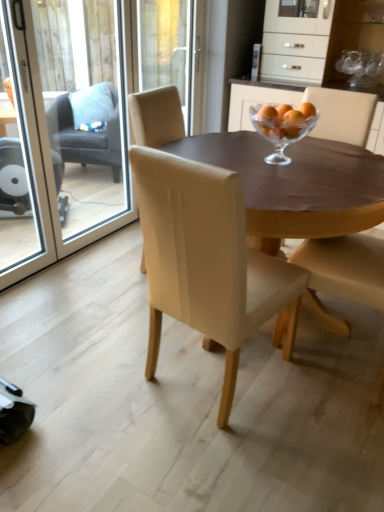
This screenshot has width=384, height=512. I want to click on beige leather chair at center, the 1th chair viewed from the front, so click(204, 258).

The image size is (384, 512). What do you see at coordinates (281, 132) in the screenshot?
I see `clear glass bowl at center` at bounding box center [281, 132].

What is the approximate width of transparent glass screen door at left, which appears as the first screen door when viewed from the right?

It is 2.82 inches.

Locate an element on the screen. light gray fabric chair at left, the 4th chair positioned from the front is located at coordinates tap(83, 139).

Describe the element at coordinates (24, 158) in the screenshot. I see `transparent glass screen door at left, the second screen door positioned from the right` at that location.

This screenshot has height=512, width=384. What do you see at coordinates (156, 117) in the screenshot?
I see `leather at center, acting as the 3th chair starting from the front` at bounding box center [156, 117].

Locate an element on the screen. beige leather chair at center, which is the fourth chair in back-to-front order is located at coordinates (204, 258).

The height and width of the screenshot is (512, 384). Identify the location of martini glass that is above the leather at center, placed as the 2th chair when sorted from left to right (from a real-world perspective). (281, 132).

Would you say leather at center, which is the 2th chair from back to front, is to the left or to the right of clear glass bowl at center in the picture?

leather at center, which is the 2th chair from back to front, is positioned on clear glass bowl at center's left side.

Would you say leather at center, the third chair viewed from the right, is outside clear glass bowl at center?

That's correct, leather at center, the third chair viewed from the right, is outside of clear glass bowl at center.

Is beige leather chair at center, which is the 3th chair in left-to-right order, directly adjacent to clear glass bowl at center?

No, beige leather chair at center, which is the 3th chair in left-to-right order, is not with clear glass bowl at center.

Is the depth of beige leather chair at center, the 1th chair viewed from the front, less than that of clear glass bowl at center?

Yes, it is.

How many degrees apart are the facing directions of beige leather chair at center, which is the 3th chair in left-to-right order, and clear glass bowl at center?

82.8 degrees separate the facing orientations of beige leather chair at center, which is the 3th chair in left-to-right order, and clear glass bowl at center.

Looking at this image, between beige leather chair at center, which is the 3th chair in left-to-right order, and clear glass bowl at center, which one has smaller size?

clear glass bowl at center.

Consider the image. Who is more distant, beige leather chair at center, which is the 3th chair in left-to-right order, or transparent glass screen door at left, which appears as the first screen door when viewed from the right?

transparent glass screen door at left, which appears as the first screen door when viewed from the right, is more distant.

Which is nearer, (198, 234) or (66, 106)?

The point (198, 234) is in front.

Is beige leather chair at center, which is the 3th chair in left-to-right order, oriented away from transparent glass screen door at left, which appears as the first screen door when viewed from the right?

beige leather chair at center, which is the 3th chair in left-to-right order, does not have its back to transparent glass screen door at left, which appears as the first screen door when viewed from the right.

Is beige leather chair at center, which is the fourth chair in back-to-front order, to the left of transparent glass screen door at left, which appears as the first screen door when viewed from the right, from the viewer's perspective?

No, beige leather chair at center, which is the fourth chair in back-to-front order, is not to the left of transparent glass screen door at left, which appears as the first screen door when viewed from the right.

Which object is further away from the camera taking this photo, transparent glass screen door at left, positioned as the 1th screen door in left-to-right order, or matte beige chair at center, the 3th chair when ordered from back to front?

transparent glass screen door at left, positioned as the 1th screen door in left-to-right order, is behind.

Which of these two, transparent glass screen door at left, the second screen door positioned from the right, or matte beige chair at center, which is the 2th chair from front to back, stands shorter?

matte beige chair at center, which is the 2th chair from front to back, is shorter.

Which point is more distant from viewer, (11,258) or (369,274)?

Positioned behind is point (11,258).

In the scene shown: Which is correct: transparent glass screen door at left, positioned as the 1th screen door in left-to-right order, is inside matte brown table at center, or outside of it?

transparent glass screen door at left, positioned as the 1th screen door in left-to-right order, is not inside matte brown table at center, it's outside.

Is transparent glass screen door at left, positioned as the 1th screen door in left-to-right order, in front of or behind matte brown table at center in the image?

transparent glass screen door at left, positioned as the 1th screen door in left-to-right order, is positioned farther from the viewer than matte brown table at center.

Image resolution: width=384 pixels, height=512 pixels. What are the coordinates of `round table below the transparent glass screen door at left, the second screen door positioned from the right (from the image's perspective)` in the screenshot? It's located at (296, 185).

Looking at this image, from the image's perspective, relative to matte brown table at center, is transparent glass screen door at left, the second screen door positioned from the right, above or below?

From the image's perspective, transparent glass screen door at left, the second screen door positioned from the right, appears above matte brown table at center.

Is leather at center, acting as the 3th chair starting from the front, taller than light gray fabric chair at left, acting as the fourth chair starting from the right?

Yes, leather at center, acting as the 3th chair starting from the front, is taller than light gray fabric chair at left, acting as the fourth chair starting from the right.

Which point is more forward, (170, 91) or (75, 159)?

Positioned in front is point (170, 91).

Looking at this image, can you confirm if leather at center, acting as the 3th chair starting from the front, is thinner than light gray fabric chair at left, acting as the fourth chair starting from the right?

Yes, leather at center, acting as the 3th chair starting from the front, is thinner than light gray fabric chair at left, acting as the fourth chair starting from the right.

From the image's perspective, is matte beige chair at center, which ranks as the 1th chair in right-to-left order, beneath light gray fabric chair at left, acting as the fourth chair starting from the right?

Yes, from the image's perspective, matte beige chair at center, which ranks as the 1th chair in right-to-left order, is below light gray fabric chair at left, acting as the fourth chair starting from the right.

Is light gray fabric chair at left, acting as the fourth chair starting from the right, at the back of matte beige chair at center, the 3th chair when ordered from back to front?

No, light gray fabric chair at left, acting as the fourth chair starting from the right, is not at the back of matte beige chair at center, the 3th chair when ordered from back to front.

Considering the sizes of objects matte beige chair at center, positioned as the 4th chair in left-to-right order, and light gray fabric chair at left, the 1th chair positioned from the left, in the image provided, who is bigger, matte beige chair at center, positioned as the 4th chair in left-to-right order, or light gray fabric chair at left, the 1th chair positioned from the left,?

→ light gray fabric chair at left, the 1th chair positioned from the left.

From a real-world perspective, is matte beige chair at center, which ranks as the 1th chair in right-to-left order, physically above light gray fabric chair at left, marked as the first chair in a back-to-front arrangement?

Yes, from a real-world perspective, matte beige chair at center, which ranks as the 1th chair in right-to-left order, is over light gray fabric chair at left, marked as the first chair in a back-to-front arrangement

You are a GUI agent. You are given a task and a screenshot of the screen. Output one action in this format:
    pyautogui.click(x=<x>, y=<y>)
    Task: Click on the martini glass above the leather at center, placed as the 2th chair when sorted from left to right (from a real-world perspective)
    
    Given the screenshot: What is the action you would take?
    pyautogui.click(x=281, y=132)

This screenshot has width=384, height=512. I want to click on martini glass that appears on the right of beige leather chair at center, which is the fourth chair in back-to-front order, so click(x=281, y=132).

Considering their positions, is transparent glass screen door at left, which is counted as the second screen door, starting from the left, positioned closer to matte brown table at center than clear glass bowl at center?

clear glass bowl at center is closer to matte brown table at center.

Considering their positions, is leather at center, the third chair viewed from the right, positioned closer to transparent glass screen door at left, the second screen door positioned from the right, than matte beige chair at center, which ranks as the 1th chair in right-to-left order?

leather at center, the third chair viewed from the right, lies closer to transparent glass screen door at left, the second screen door positioned from the right, than the other object.

Based on their spatial positions, is matte brown table at center or matte beige chair at center, which is the 2th chair from front to back, closer to clear glass bowl at center?

matte brown table at center is positioned closer to the anchor clear glass bowl at center.

Considering their positions, is transparent glass screen door at left, which appears as the first screen door when viewed from the right, positioned closer to beige leather chair at center, which is the 3th chair in left-to-right order, than matte brown table at center?

matte brown table at center lies closer to beige leather chair at center, which is the 3th chair in left-to-right order, than the other object.

Consider the image. Based on their spatial positions, is leather at center, acting as the 3th chair starting from the front, or transparent glass screen door at left, which is counted as the second screen door, starting from the left, closer to clear glass bowl at center?

Based on the image, leather at center, acting as the 3th chair starting from the front, appears to be nearer to clear glass bowl at center.

Considering their positions, is matte beige chair at center, positioned as the 4th chair in left-to-right order, positioned further to transparent glass screen door at left, the second screen door positioned from the right, than transparent glass screen door at left, which appears as the first screen door when viewed from the right?

matte beige chair at center, positioned as the 4th chair in left-to-right order.

When comparing their distances from light gray fabric chair at left, marked as the first chair in a back-to-front arrangement, does matte beige chair at center, which is the 2th chair from front to back, or leather at center, which is the 2th chair from back to front, seem closer?

leather at center, which is the 2th chair from back to front, is closer to light gray fabric chair at left, marked as the first chair in a back-to-front arrangement.

When comparing their distances from matte brown table at center, does transparent glass screen door at left, the second screen door positioned from the right, or leather at center, placed as the 2th chair when sorted from left to right, seem further?

Among the two, transparent glass screen door at left, the second screen door positioned from the right, is located further to matte brown table at center.

The width and height of the screenshot is (384, 512). What are the coordinates of `martini glass located between beige leather chair at center, positioned as the 2th chair in right-to-left order, and light gray fabric chair at left, the 1th chair positioned from the left, in the depth direction` in the screenshot? It's located at (281, 132).

Locate an element on the screen. chair located between matte beige chair at center, the 3th chair when ordered from back to front, and light gray fabric chair at left, marked as the first chair in a back-to-front arrangement, in the depth direction is located at coordinates (156, 117).

Where is `round table between transparent glass screen door at left, positioned as the 1th screen door in left-to-right order, and clear glass bowl at center from left to right`? The width and height of the screenshot is (384, 512). round table between transparent glass screen door at left, positioned as the 1th screen door in left-to-right order, and clear glass bowl at center from left to right is located at coordinates (296, 185).

Locate an element on the screen. The height and width of the screenshot is (512, 384). martini glass that lies between transparent glass screen door at left, which appears as the first screen door when viewed from the right, and beige leather chair at center, positioned as the 2th chair in right-to-left order, from top to bottom is located at coordinates 281,132.